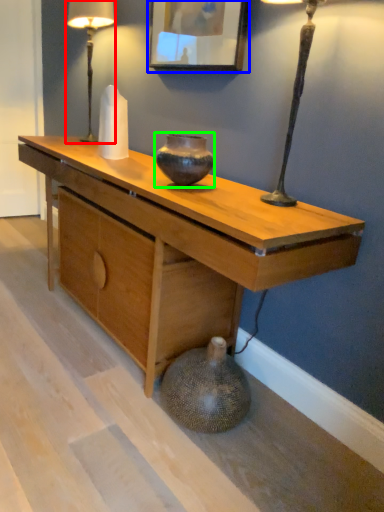
Question: Which is farther away from table lamp (highlighted by a red box)? picture frame (highlighted by a blue box) or vase (highlighted by a green box)?

Choices:
 (A) picture frame
 (B) vase

Answer: (B)